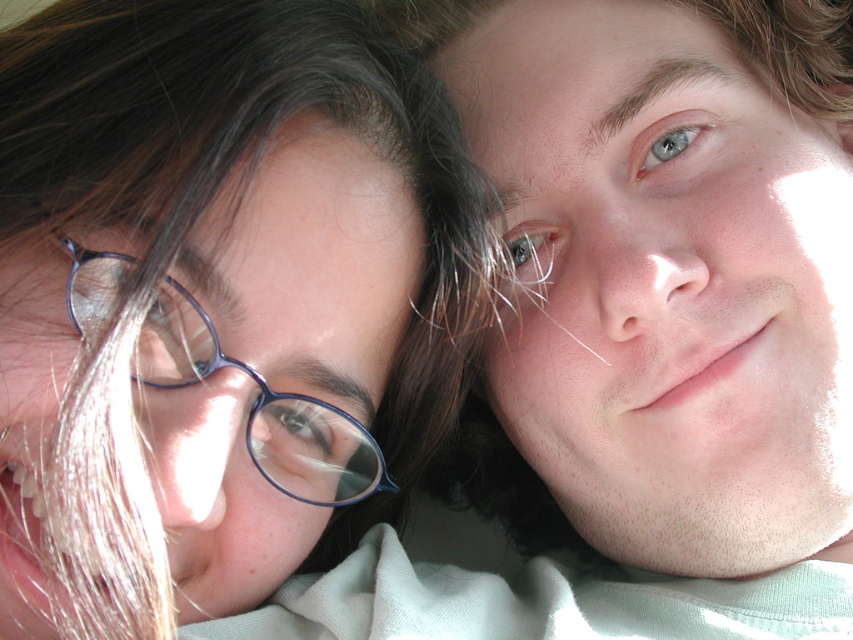
This screenshot has height=640, width=853. What do you see at coordinates (216, 300) in the screenshot? I see `matte blue glasses at center` at bounding box center [216, 300].

Is point (24, 266) in front of point (457, 22)?

Yes.

Does point (453, 381) come farther from viewer compared to point (752, 435)?

Yes, point (453, 381) is behind point (752, 435).

Find the location of `matte blue glasses at center`. matte blue glasses at center is located at coordinates (216, 300).

Which is below, matte blue glasses at center or blue plastic glasses at left?

Positioned lower is blue plastic glasses at left.

Consider the image. Can you confirm if matte blue glasses at center is positioned below blue plastic glasses at left?

Incorrect, matte blue glasses at center is not positioned below blue plastic glasses at left.

Identify the location of matte blue glasses at center. (216, 300).

The width and height of the screenshot is (853, 640). Identify the location of matte blue glasses at center. [x=216, y=300].

Is smooth skin face at upper right wider than blue plastic glasses at left?

Yes, smooth skin face at upper right is wider than blue plastic glasses at left.

Looking at this image, does smooth skin face at upper right appear under blue plastic glasses at left?

No, smooth skin face at upper right is not below blue plastic glasses at left.

Locate an element on the screen. This screenshot has width=853, height=640. smooth skin face at upper right is located at coordinates (672, 266).

Image resolution: width=853 pixels, height=640 pixels. I want to click on smooth skin face at upper right, so click(672, 266).